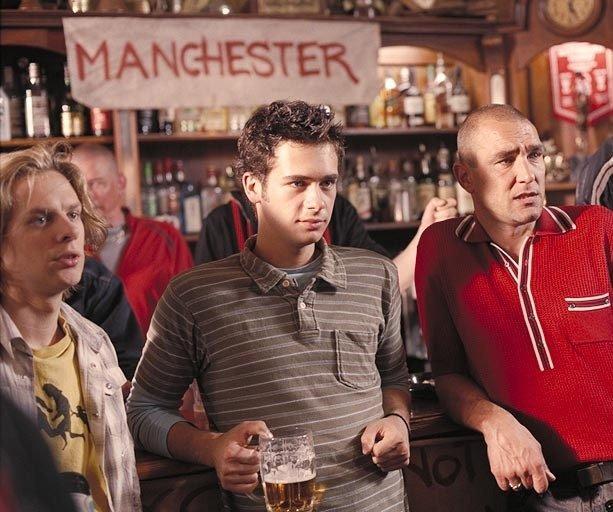
You are a GUI agent. You are given a task and a screenshot of the screen. Output one action in this format:
    pyautogui.click(x=<x>, y=<y>)
    Task: Click on the mug
    This screenshot has width=613, height=512.
    Given the screenshot: What is the action you would take?
    pyautogui.click(x=284, y=457)